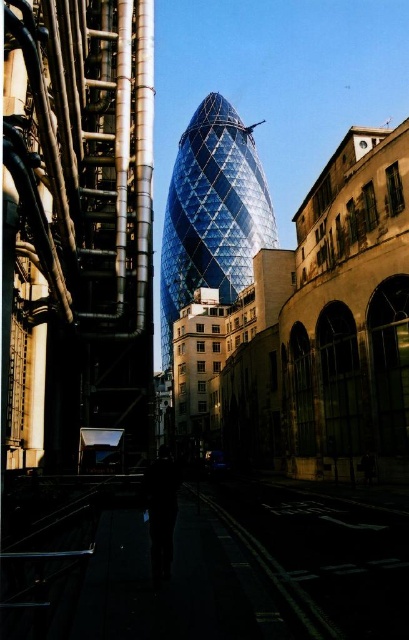
You are standing in the urban scene and want to determine which of the two points, point (262, 554) or point (163, 298), is closer to you. Based on the scene, which point is nearer?

Point (262, 554) is closer to the viewer than point (163, 298).

You are a city planner assessing the urban layout. The white reflective pavement at lower center and the shiny glass tower at center are both part of the cityscape. Which of these two has a smaller width?

The white reflective pavement at lower center has a smaller width than the shiny glass tower at center according to the description.